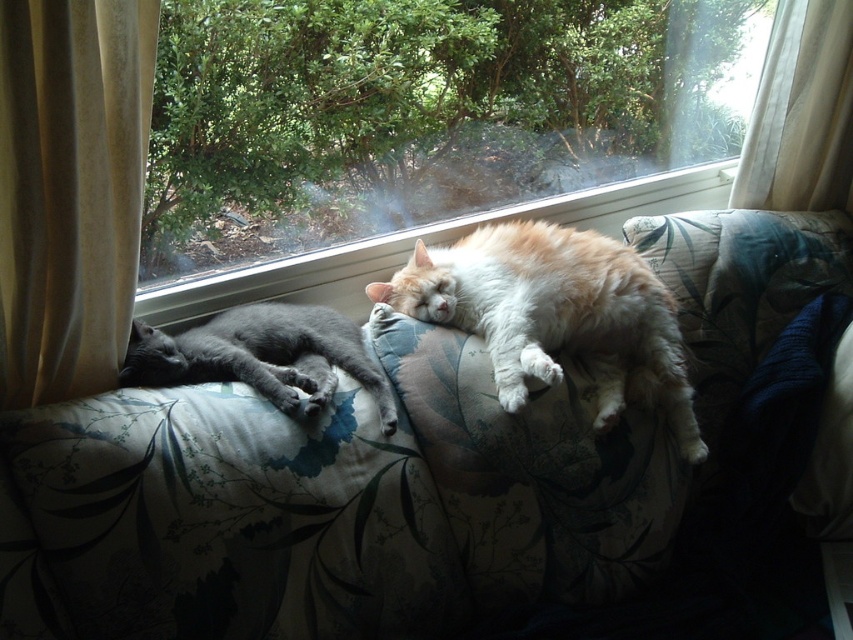
Question: Is transparent glass window at upper center in front of white sheer curtain at upper right?

Choices:
 (A) no
 (B) yes

Answer: (B)

Question: Which point is closer to the camera?

Choices:
 (A) matte gray cat at left
 (B) velvet beige curtain at left
 (C) transparent glass window at upper center

Answer: (B)

Question: Which point appears farthest from the camera in this image?

Choices:
 (A) (819, 192)
 (B) (403, 154)

Answer: (A)

Question: Does floral fabric couch at center appear under transparent glass window at upper center?

Choices:
 (A) no
 (B) yes

Answer: (B)

Question: Is floral fabric couch at center positioned before matte gray cat at left?

Choices:
 (A) yes
 (B) no

Answer: (A)

Question: Considering the real-world distances, which object is closest to the fluffy orange cat at center?

Choices:
 (A) matte gray cat at left
 (B) floral fabric couch at center
 (C) transparent glass window at upper center
 (D) velvet beige curtain at left

Answer: (B)